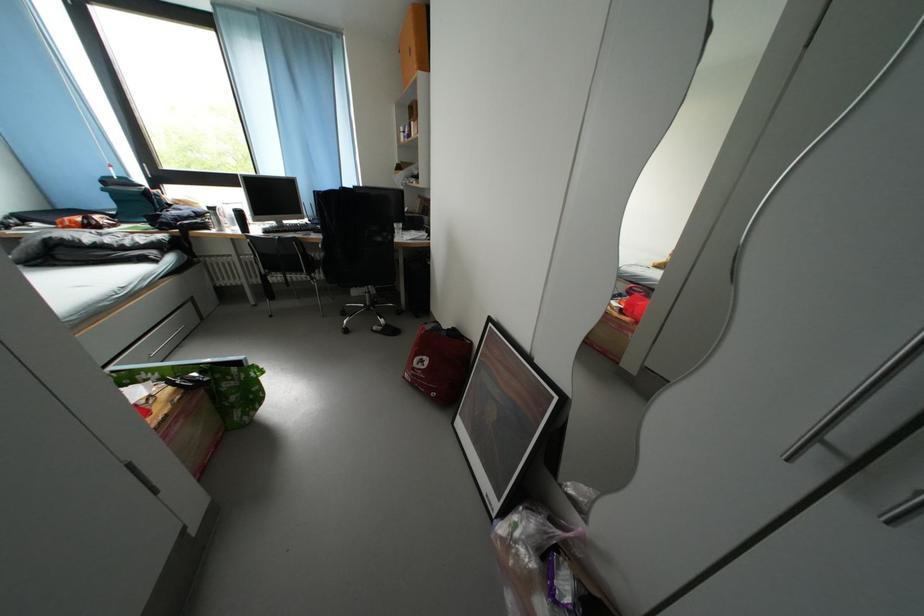
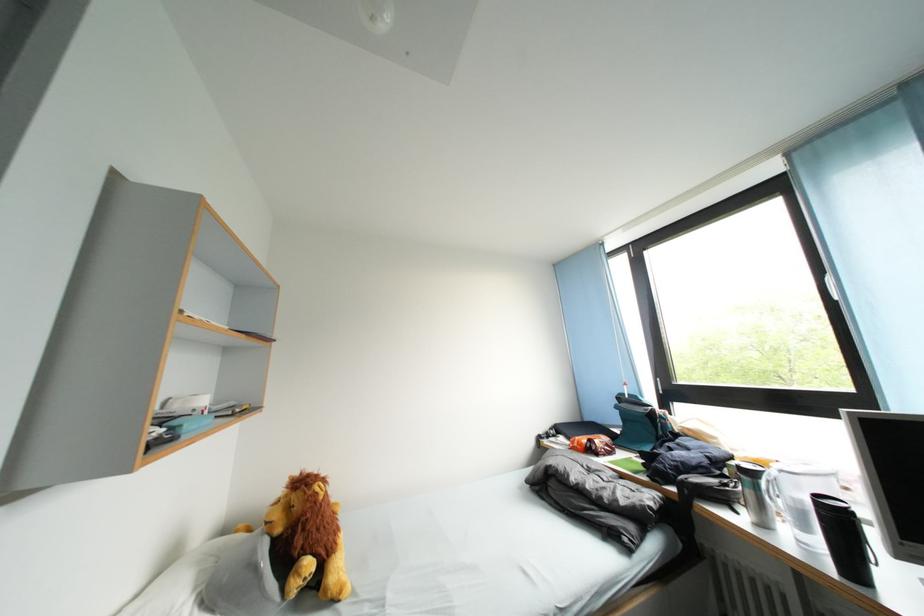
In the second image, find the point that corresponds to point (248, 219) in the first image.

(844, 522)